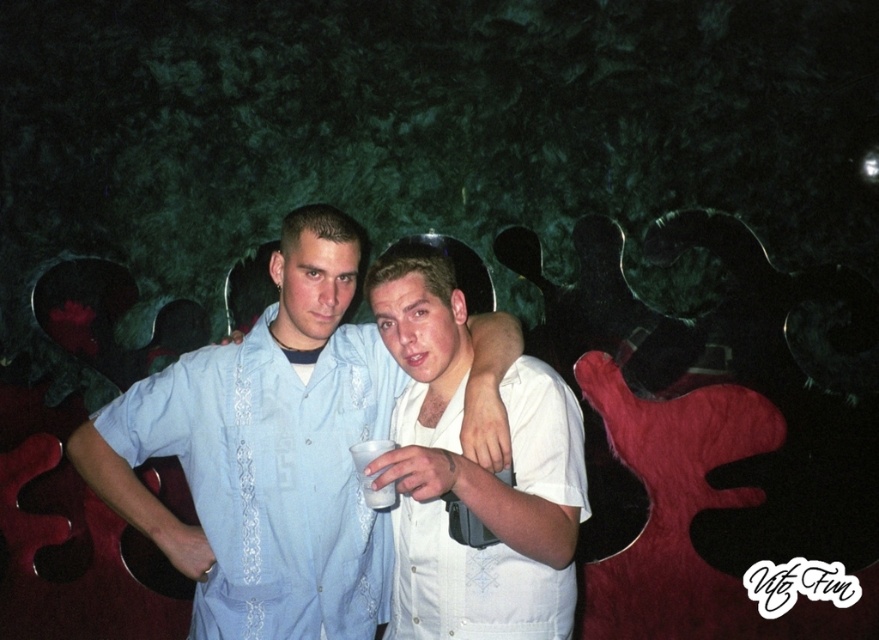
Does light blue embroidered shirt at center appear over white matte cup at center?

Correct, light blue embroidered shirt at center is located above white matte cup at center.

What are the coordinates of `light blue embroidered shirt at center` in the screenshot? It's located at (265, 452).

In order to click on light blue embroidered shirt at center in this screenshot , I will do `click(265, 452)`.

Is light blue embroidered shirt at center to the right of white cotton shirt at center from the viewer's perspective?

In fact, light blue embroidered shirt at center is to the left of white cotton shirt at center.

Who is shorter, light blue embroidered shirt at center or white cotton shirt at center?

With less height is white cotton shirt at center.

Where is `light blue embroidered shirt at center`? This screenshot has height=640, width=879. light blue embroidered shirt at center is located at coordinates (265, 452).

Is white cotton shirt at center above white matte cup at center?

No.

Is point (534, 592) farther from viewer compared to point (384, 506)?

Yes.

Does point (565, 483) come behind point (386, 493)?

Yes, it is behind point (386, 493).

Locate an element on the screen. This screenshot has width=879, height=640. white cotton shirt at center is located at coordinates (470, 584).